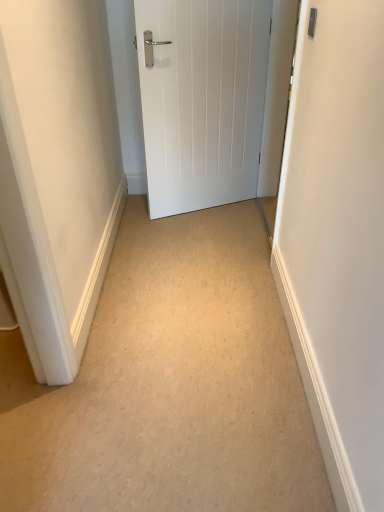
Question: From a real-world perspective, is beige carpet at center above or below white matte door at center?

Choices:
 (A) below
 (B) above

Answer: (A)

Question: Is point (76, 434) positioned closer to the camera than point (251, 195)?

Choices:
 (A) closer
 (B) farther

Answer: (A)

Question: Looking at their shapes, would you say beige carpet at center is wider or thinner than white matte door at center?

Choices:
 (A) wide
 (B) thin

Answer: (A)

Question: Based on their sizes in the image, would you say white matte door at center is bigger or smaller than beige carpet at center?

Choices:
 (A) big
 (B) small

Answer: (A)

Question: From the image's perspective, is white matte door at center positioned above or below beige carpet at center?

Choices:
 (A) above
 (B) below

Answer: (A)

Question: In terms of height, does white matte door at center look taller or shorter compared to beige carpet at center?

Choices:
 (A) short
 (B) tall

Answer: (B)

Question: In terms of width, does white matte door at center look wider or thinner when compared to beige carpet at center?

Choices:
 (A) wide
 (B) thin

Answer: (B)